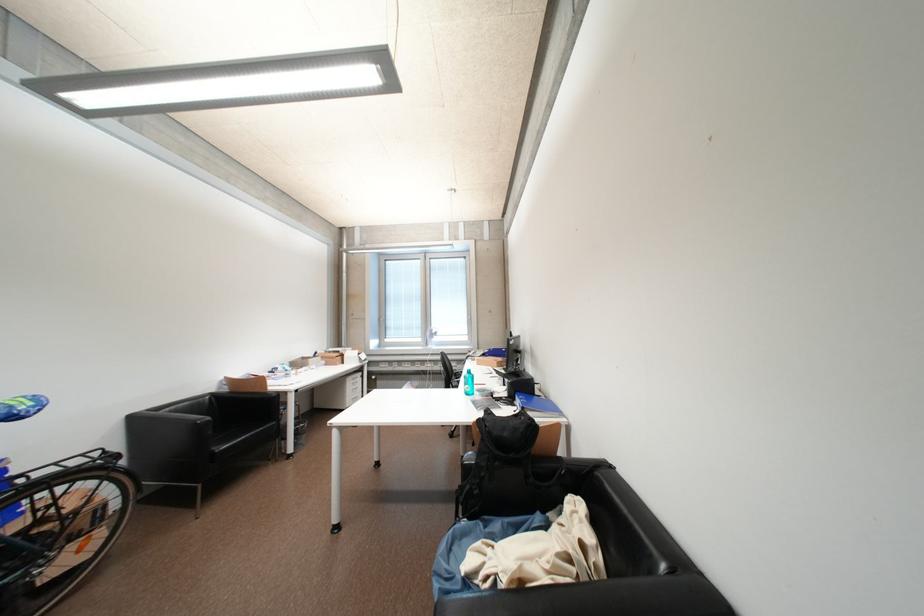
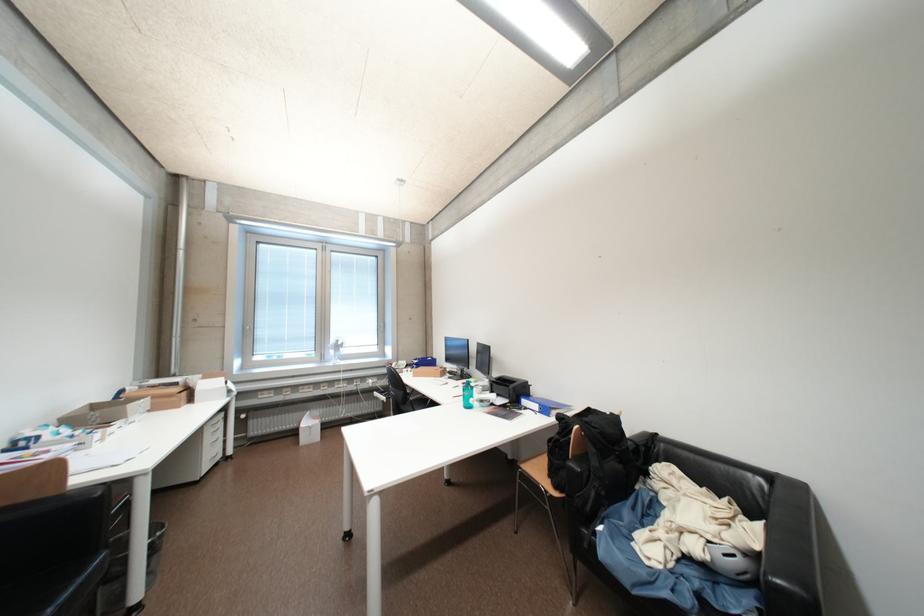
The point at [346,354] is marked in the first image. Where is the corresponding point in the second image?

(184, 386)